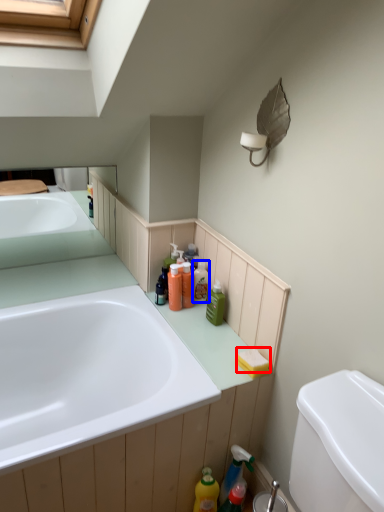
Question: Which point is closer to the camera, soap (highlighted by a red box) or toiletry (highlighted by a blue box)?

Choices:
 (A) soap
 (B) toiletry

Answer: (A)